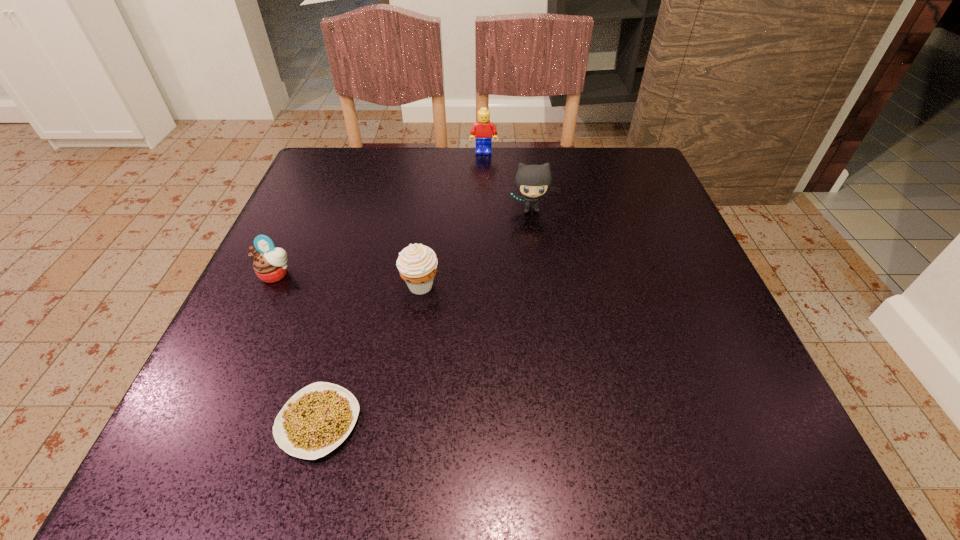
This screenshot has width=960, height=540. I want to click on free location that satisfies the following two spatial constraints: 1. on the front-facing side of the second shortest object; 2. on the right side of the nearest object, so click(207, 422).